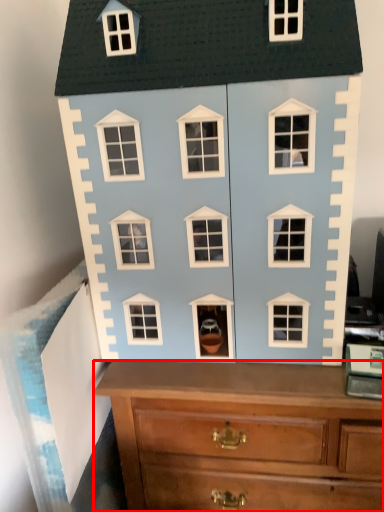
Question: From the image, what is the correct spatial relationship of chest of drawers (annotated by the red box) in relation to toy?

Choices:
 (A) right
 (B) left

Answer: (A)